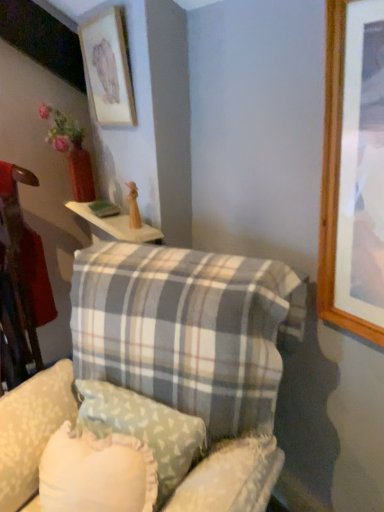
The width and height of the screenshot is (384, 512). In order to click on white wood table at upper center in this screenshot , I will do `click(116, 224)`.

This screenshot has width=384, height=512. Describe the element at coordinates (31, 429) in the screenshot. I see `plaid fabric swivel chair at lower center` at that location.

Image resolution: width=384 pixels, height=512 pixels. I want to click on plaid fabric swivel chair at lower center, so click(x=31, y=429).

Locate an element on the screen. Image resolution: width=384 pixels, height=512 pixels. plaid fabric pillow at center, the first pillow positioned from the front is located at coordinates point(183,329).

I want to click on matte wooden picture frame at upper left, so click(108, 68).

Visually, is matte wooden picture frame at upper left positioned to the left or to the right of plaid fabric pillow at center, the first pillow positioned from the front?

From the image, it's evident that matte wooden picture frame at upper left is to the left of plaid fabric pillow at center, the first pillow positioned from the front.

Considering the sizes of matte wooden picture frame at upper left and plaid fabric pillow at center, the first pillow positioned from the front, in the image, is matte wooden picture frame at upper left taller or shorter than plaid fabric pillow at center, the first pillow positioned from the front,?

Considering their sizes, matte wooden picture frame at upper left has less height than plaid fabric pillow at center, the first pillow positioned from the front.

How different are the orientations of matte wooden picture frame at upper left and plaid fabric pillow at center, positioned as the 2th pillow in back-to-front order, in degrees?

A: They differ by 25.8 degrees in their facing directions.

From the image's perspective, is matte wooden picture frame at upper left above or below plaid fabric pillow at center, positioned as the 2th pillow in back-to-front order?

matte wooden picture frame at upper left is above plaid fabric pillow at center, positioned as the 2th pillow in back-to-front order.

From the picture: Which of these two, light blue fabric pillow at center, the 2th pillow positioned from the front, or plaid fabric pillow at center, the first pillow positioned from the front, is smaller?

With smaller size is light blue fabric pillow at center, the 2th pillow positioned from the front.

From a real-world perspective, who is located higher, light blue fabric pillow at center, the 2th pillow positioned from the front, or plaid fabric pillow at center, the first pillow positioned from the front?

light blue fabric pillow at center, the 2th pillow positioned from the front.

Who is more distant, light blue fabric pillow at center, the 2th pillow positioned from the front, or plaid fabric pillow at center, positioned as the 2th pillow in back-to-front order?

Positioned behind is light blue fabric pillow at center, the 2th pillow positioned from the front.

From the image's perspective, between white wood table at upper center and matte wooden picture frame at upper left, which one is located above?

matte wooden picture frame at upper left is shown above in the image.

Considering the sizes of white wood table at upper center and matte wooden picture frame at upper left in the image, is white wood table at upper center bigger or smaller than matte wooden picture frame at upper left?

Clearly, white wood table at upper center is smaller in size than matte wooden picture frame at upper left.

Which is more to the left, white wood table at upper center or matte wooden picture frame at upper left?

white wood table at upper center is more to the left.

Is light blue fabric pillow at center, the 2th pillow positioned from the front, shorter than plaid fabric swivel chair at lower center?

Correct, light blue fabric pillow at center, the 2th pillow positioned from the front, is not as tall as plaid fabric swivel chair at lower center.

Is point (151, 436) closer or farther from the camera than point (21, 443)?

Point (151, 436).

Is light blue fabric pillow at center, the 2th pillow positioned from the front, far from plaid fabric swivel chair at lower center?

Actually, light blue fabric pillow at center, the 2th pillow positioned from the front, and plaid fabric swivel chair at lower center are a little close together.

You are a GUI agent. You are given a task and a screenshot of the screen. Output one action in this format:
    pyautogui.click(x=<x>, y=<y>)
    Task: Click on the swivel chair on the left of light blue fabric pillow at center, the 2th pillow positioned from the front
    The height and width of the screenshot is (512, 384).
    Given the screenshot: What is the action you would take?
    pyautogui.click(x=31, y=429)

Is light blue fabric pillow at center, which is counted as the first pillow, starting from the back, aimed at white wood table at upper center?

No, light blue fabric pillow at center, which is counted as the first pillow, starting from the back, is not oriented towards white wood table at upper center.

In terms of size, does light blue fabric pillow at center, which is counted as the first pillow, starting from the back, appear bigger or smaller than white wood table at upper center?

In the image, light blue fabric pillow at center, which is counted as the first pillow, starting from the back, appears to be larger than white wood table at upper center.

Which object is further away from the camera, light blue fabric pillow at center, the 2th pillow positioned from the front, or white wood table at upper center?

white wood table at upper center is further from the camera.

How many degrees apart are the facing directions of matte wooden picture frame at upper left and plaid fabric swivel chair at lower center?

The angle between the facing direction of matte wooden picture frame at upper left and the facing direction of plaid fabric swivel chair at lower center is 25.8 degrees.

Considering the positions of objects matte wooden picture frame at upper left and plaid fabric swivel chair at lower center in the image provided, who is in front, matte wooden picture frame at upper left or plaid fabric swivel chair at lower center?

plaid fabric swivel chair at lower center is closer to the camera.

Which point is more distant from viewer, (97,22) or (6,450)?

Point (97,22)

From a real-world perspective, who is located lower, matte wooden picture frame at upper left or plaid fabric swivel chair at lower center?

plaid fabric swivel chair at lower center.

Would you consider light blue fabric pillow at center, the 2th pillow positioned from the front, to be distant from matte wooden picture frame at upper left?

That's right, there is a large distance between light blue fabric pillow at center, the 2th pillow positioned from the front, and matte wooden picture frame at upper left.

Considering the sizes of objects light blue fabric pillow at center, the 2th pillow positioned from the front, and matte wooden picture frame at upper left in the image provided, who is thinner, light blue fabric pillow at center, the 2th pillow positioned from the front, or matte wooden picture frame at upper left?

matte wooden picture frame at upper left.

Can you tell me how much light blue fabric pillow at center, the 2th pillow positioned from the front, and matte wooden picture frame at upper left differ in facing direction?

25.8 degrees.

Is light blue fabric pillow at center, the 2th pillow positioned from the front, surrounding matte wooden picture frame at upper left?

No, light blue fabric pillow at center, the 2th pillow positioned from the front, does not contain matte wooden picture frame at upper left.

Find the location of a particular element. Image resolution: width=384 pixels, height=512 pixels. the 2nd pillow below the matte wooden picture frame at upper left (from the image's perspective) is located at coordinates (183, 329).

In order to click on pillow on the left of light blue fabric pillow at center, the 2th pillow positioned from the front in this screenshot , I will do `click(183, 329)`.

From the image, which object appears to be nearer to plaid fabric swivel chair at lower center, matte wooden picture frame at upper left or plaid fabric pillow at center, the first pillow positioned from the front?

Based on the image, plaid fabric pillow at center, the first pillow positioned from the front, appears to be nearer to plaid fabric swivel chair at lower center.

Which object lies nearer to the anchor point matte wooden picture frame at upper left, light blue fabric pillow at center, which is counted as the first pillow, starting from the back, or white wood table at upper center?

white wood table at upper center is closer to matte wooden picture frame at upper left.

Which object lies further to the anchor point plaid fabric swivel chair at lower center, light blue fabric pillow at center, the 2th pillow positioned from the front, or plaid fabric pillow at center, positioned as the 2th pillow in back-to-front order?

Based on the image, plaid fabric pillow at center, positioned as the 2th pillow in back-to-front order, appears to be further to plaid fabric swivel chair at lower center.

From the picture: Estimate the real-world distances between objects in this image. Which object is further from plaid fabric pillow at center, positioned as the 2th pillow in back-to-front order, light blue fabric pillow at center, the 2th pillow positioned from the front, or white wood table at upper center?

white wood table at upper center is positioned further to the anchor plaid fabric pillow at center, positioned as the 2th pillow in back-to-front order.

Looking at the image, which one is located closer to white wood table at upper center, plaid fabric pillow at center, the first pillow positioned from the front, or light blue fabric pillow at center, the 2th pillow positioned from the front?

plaid fabric pillow at center, the first pillow positioned from the front.

From the image, which object appears to be nearer to white wood table at upper center, plaid fabric swivel chair at lower center or light blue fabric pillow at center, the 2th pillow positioned from the front?

plaid fabric swivel chair at lower center is positioned closer to the anchor white wood table at upper center.

Which object lies nearer to the anchor point plaid fabric pillow at center, positioned as the 2th pillow in back-to-front order, light blue fabric pillow at center, which is counted as the first pillow, starting from the back, or plaid fabric swivel chair at lower center?

Among the two, light blue fabric pillow at center, which is counted as the first pillow, starting from the back, is located nearer to plaid fabric pillow at center, positioned as the 2th pillow in back-to-front order.

Considering their positions, is matte wooden picture frame at upper left positioned further to plaid fabric swivel chair at lower center than white wood table at upper center?

The object further to plaid fabric swivel chair at lower center is matte wooden picture frame at upper left.

The height and width of the screenshot is (512, 384). In order to click on table between matte wooden picture frame at upper left and plaid fabric swivel chair at lower center from top to bottom in this screenshot , I will do `click(116, 224)`.

Locate an element on the screen. This screenshot has width=384, height=512. swivel chair between plaid fabric pillow at center, the first pillow positioned from the front, and white wood table at upper center from front to back is located at coordinates (31, 429).

Locate an element on the screen. The height and width of the screenshot is (512, 384). table between matte wooden picture frame at upper left and plaid fabric pillow at center, positioned as the 2th pillow in back-to-front order, from top to bottom is located at coordinates (116, 224).

Identify the location of swivel chair located between plaid fabric pillow at center, positioned as the 2th pillow in back-to-front order, and light blue fabric pillow at center, the 2th pillow positioned from the front, in the depth direction. The height and width of the screenshot is (512, 384). [31, 429].